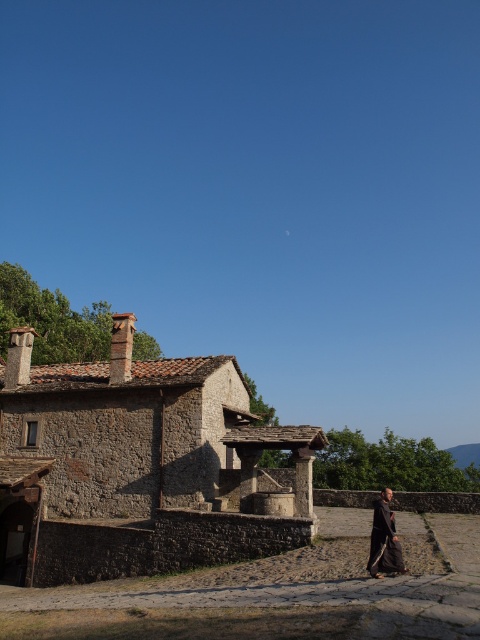
Between rustic stone village at lower left and dark brown woolen robe at lower right, which one is positioned lower?

dark brown woolen robe at lower right

Is point (39, 468) positioned after point (375, 573)?

Yes, point (39, 468) is farther from viewer.

Image resolution: width=480 pixels, height=640 pixels. What do you see at coordinates (142, 465) in the screenshot?
I see `rustic stone village at lower left` at bounding box center [142, 465].

You are a GUI agent. You are given a task and a screenshot of the screen. Output one action in this format:
    pyautogui.click(x=<x>, y=<y>)
    Task: Click on the rustic stone village at lower left
    
    Given the screenshot: What is the action you would take?
    pyautogui.click(x=142, y=465)